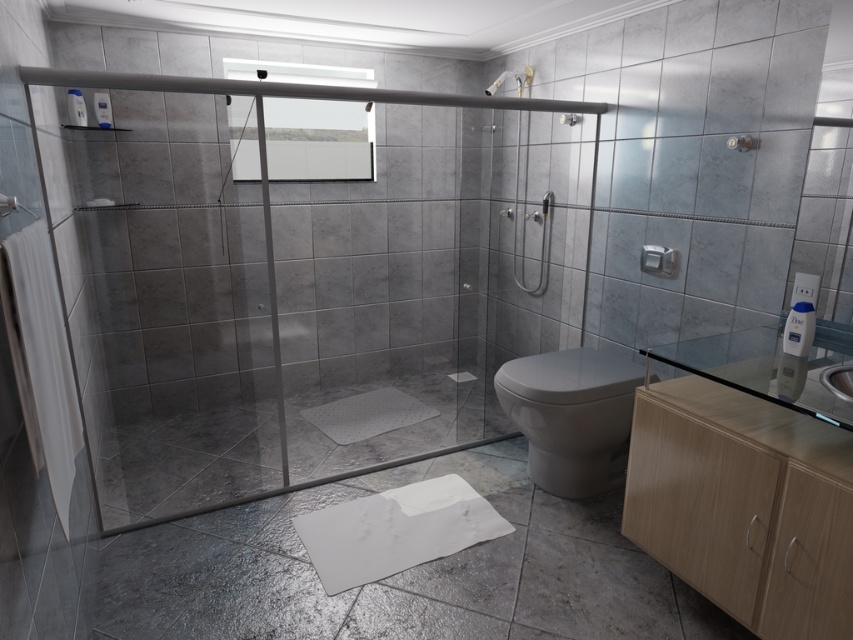
You are a bathroom designer planning to place a new 1.2 meter wide storage cabinet between the white glossy toilet at lower right and the white glossy sink at lower right. Based on their sizes, will the cabinet fit in the space between them?

The white glossy toilet at lower right is wider than the white glossy sink at lower right. However, since the exact widths aren